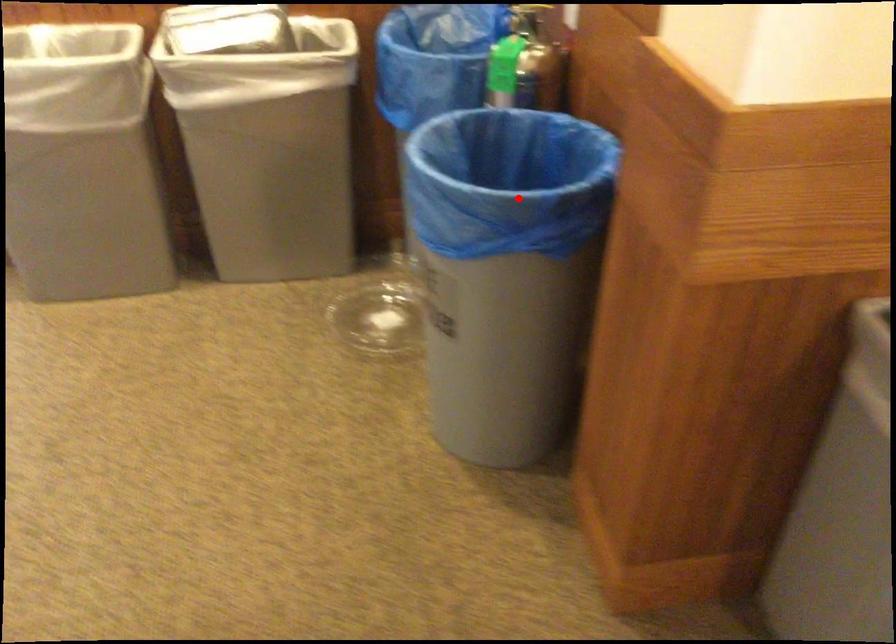
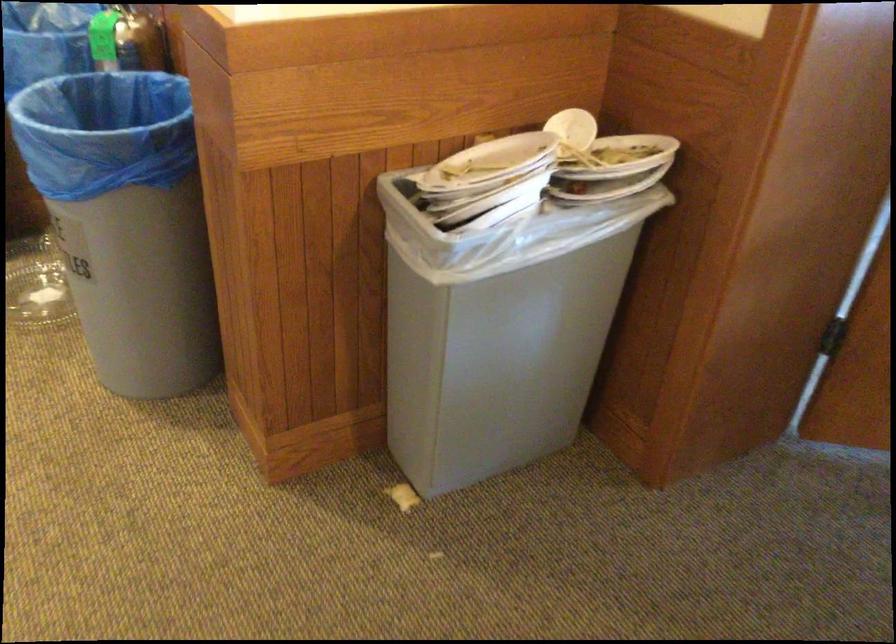
The point at the highlighted location is marked in the first image. Where is the corresponding point in the second image?

(114, 140)